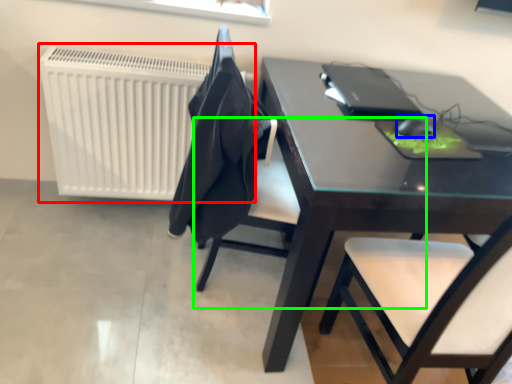
Question: Which object is the closest to the radiator (highlighted by a red box)? Choose among these: mouse (highlighted by a blue box) or chair (highlighted by a green box).

Choices:
 (A) mouse
 (B) chair

Answer: (B)